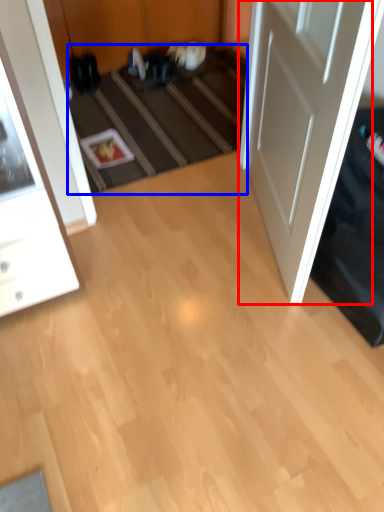
Question: Among these objects, which one is farthest to the camera, door (highlighted by a red box) or stair (highlighted by a blue box)?

Choices:
 (A) door
 (B) stair

Answer: (B)